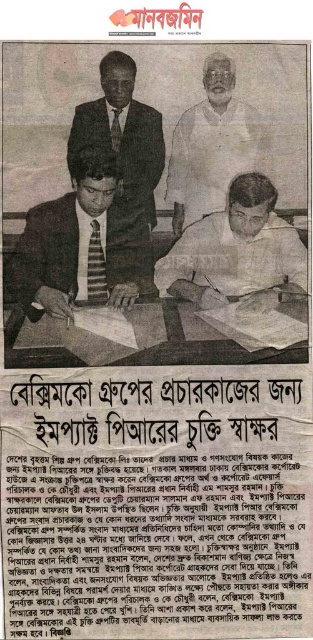
Question: Is striped tie at center positioned behind white cotton shirt at center?

Choices:
 (A) yes
 (B) no

Answer: (A)

Question: Can you confirm if striped tie at center is thinner than white cotton shirt at center?

Choices:
 (A) yes
 (B) no

Answer: (B)

Question: Which is farther from the black paper text at center?

Choices:
 (A) matte black pen at center
 (B) white cotton shirt at center
 (C) dark blue suit at center

Answer: (C)

Question: Which point is farther to the camera?

Choices:
 (A) striped tie at center
 (B) white cotton shirt at center
 (C) black paper text at center
 (D) matte black pen at center

Answer: (D)

Question: Which object appears closest to the camera in this image?

Choices:
 (A) black paper text at center
 (B) dark blue suit at center
 (C) matte black pen at center

Answer: (A)

Question: Is black paper text at center closer to the viewer compared to matte black pen at center?

Choices:
 (A) yes
 (B) no

Answer: (A)